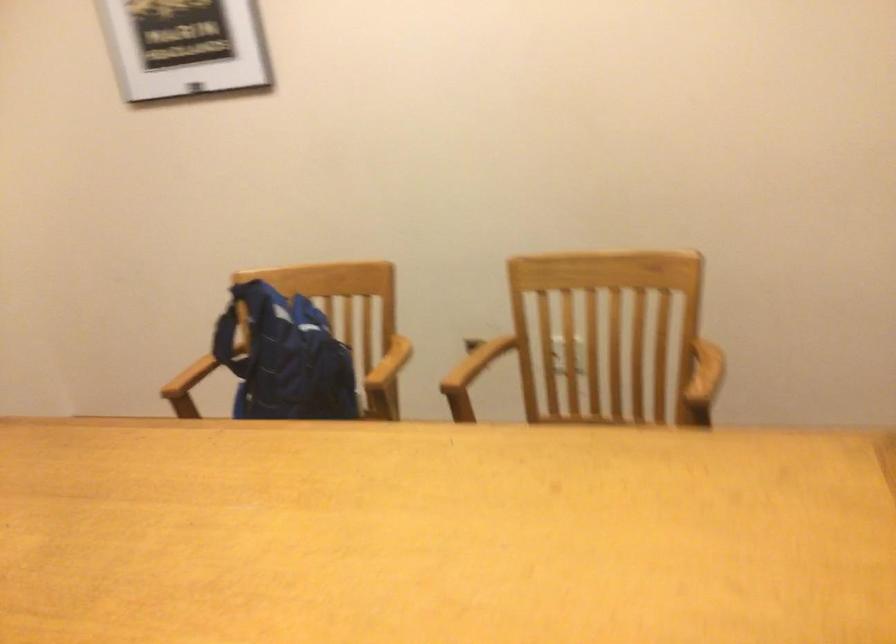
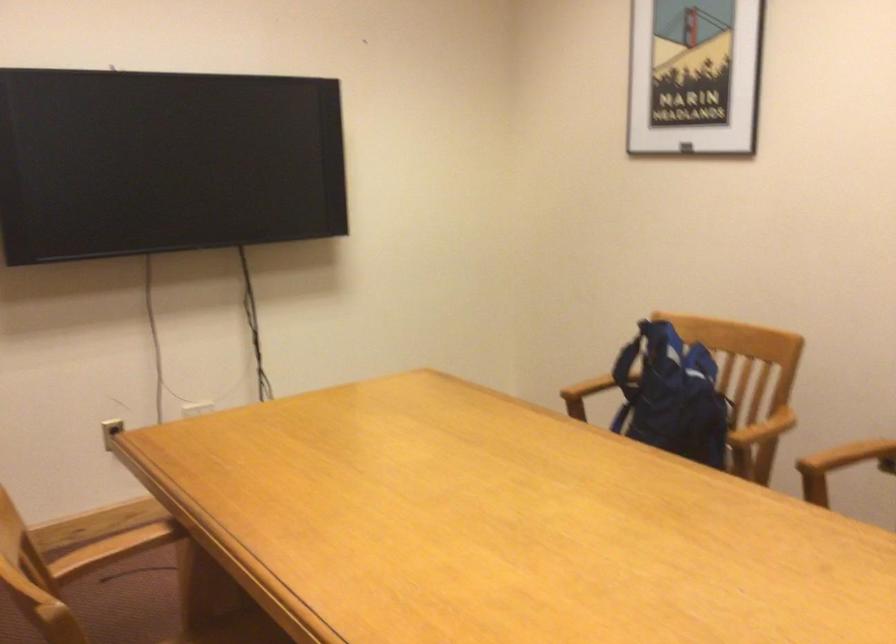
Question: The first image is from the beginning of the video and the second image is from the end. How did the camera likely rotate when shooting the video?

Choices:
 (A) Left
 (B) Right
 (C) Up
 (D) Down

Answer: (A)